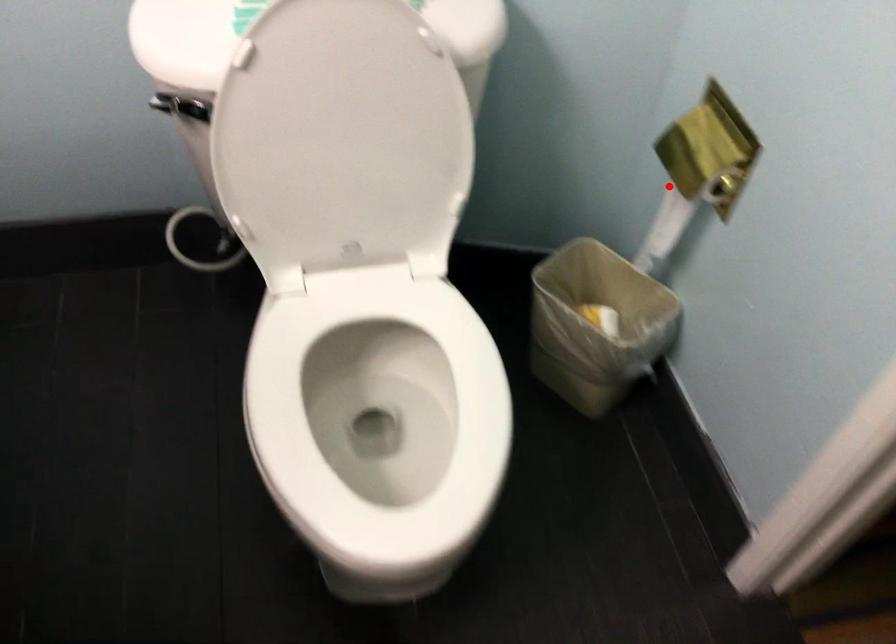
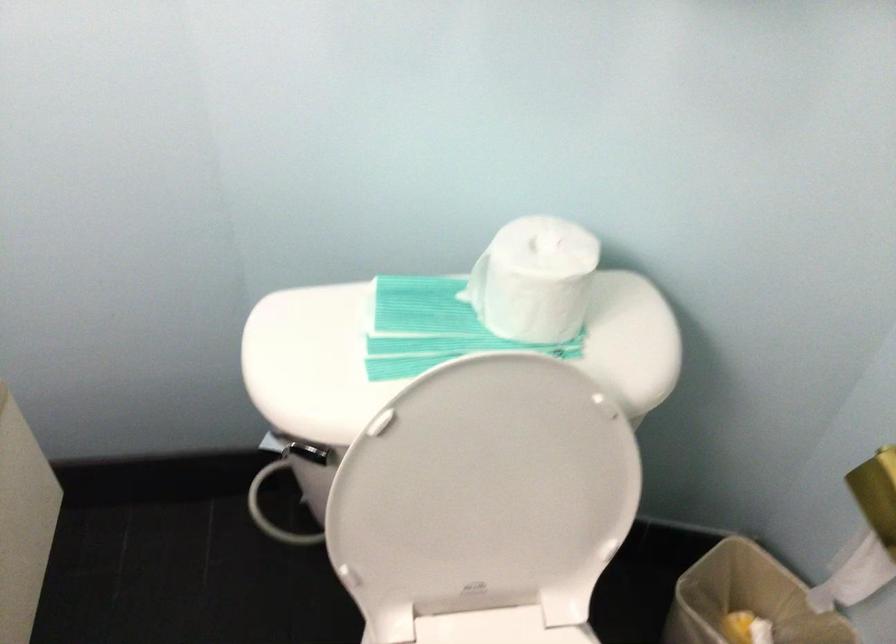
Where in the second image is the point corresponding to the highlighted location from the first image?

(866, 534)